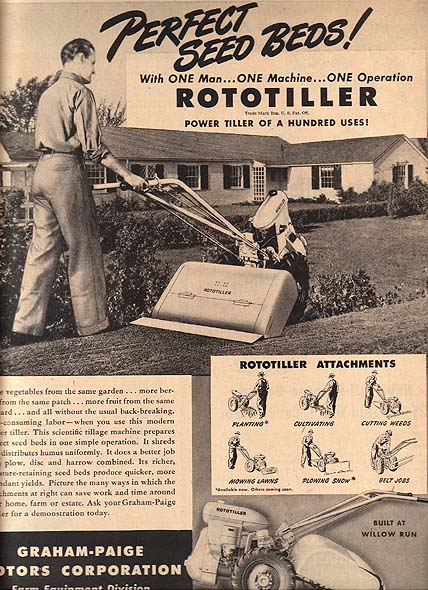
This screenshot has width=428, height=590. I want to click on black shutters, so click(x=228, y=179).